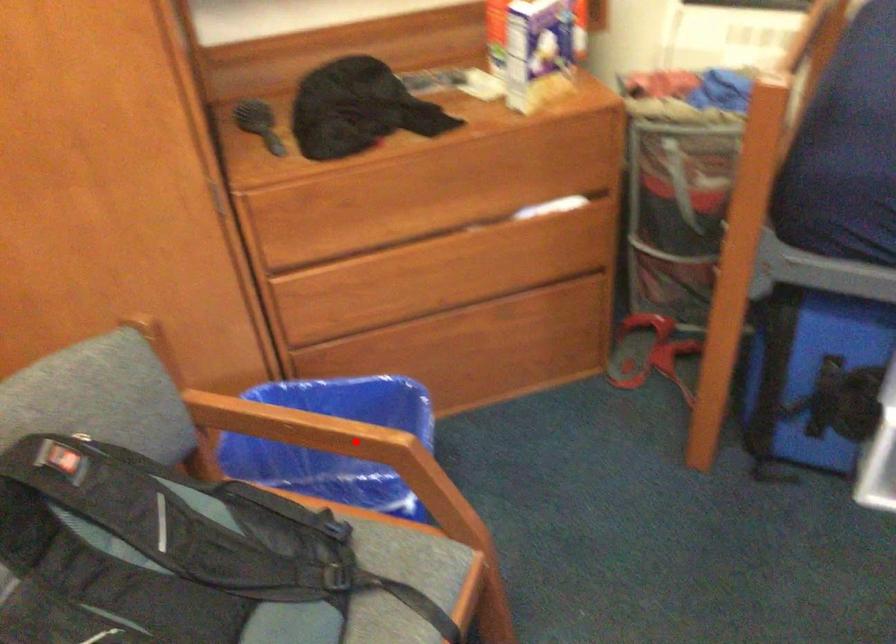
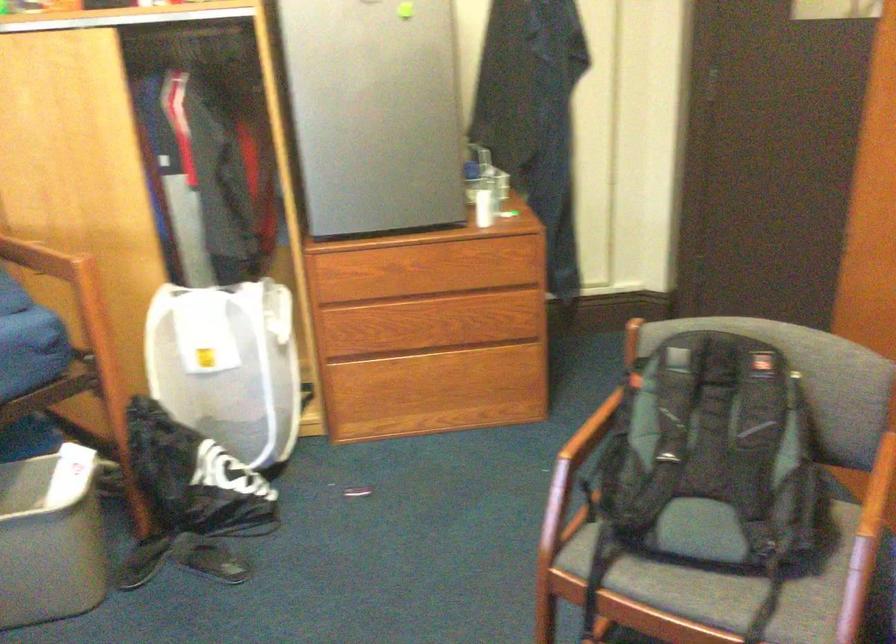
Question: I am providing you with two images of the same scene from different viewpoints. Image1 has a red point marked. In image2, the corresponding 3D location appears at what relative position? Reply with the corresponding letter.

Choices:
 (A) Closer
 (B) Farther

Answer: (B)